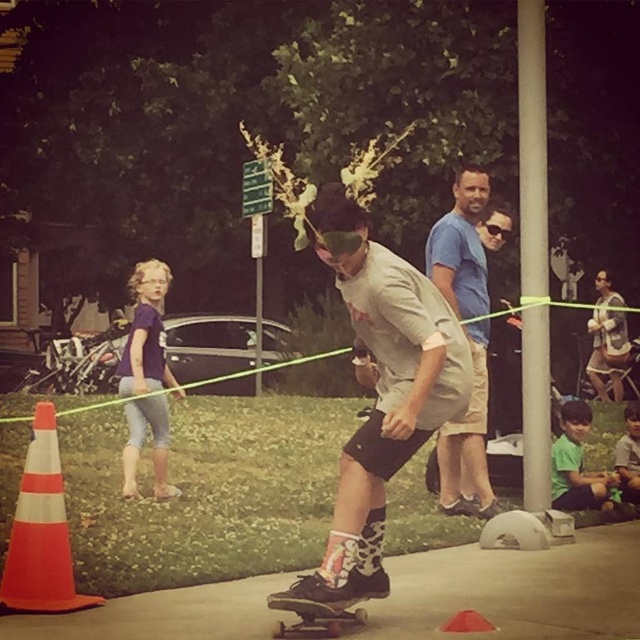
Is point (337, 228) behind point (52, 504)?

That is False.

Identify the location of light gray cotton shirt at center. (381, 388).

Between point (364, 451) and point (40, 557), which one is positioned in front?

Positioned in front is point (364, 451).

Image resolution: width=640 pixels, height=640 pixels. I want to click on light gray cotton shirt at center, so click(x=381, y=388).

Who is more forward, [410,396] or [460,512]?

Point [410,396] is more forward.

Who is positioned more to the left, light gray cotton shirt at center or light blue cotton shirt at center?

Positioned to the left is light gray cotton shirt at center.

The height and width of the screenshot is (640, 640). I want to click on light gray cotton shirt at center, so click(381, 388).

This screenshot has height=640, width=640. Find the location of `light gray cotton shirt at center`. light gray cotton shirt at center is located at coordinates (381, 388).

Which of these two, orange/white striped cone at left or plaid flannel shirt at center, stands shorter?

orange/white striped cone at left is shorter.

Is point (45, 497) closer to camera compared to point (586, 321)?

Yes, point (45, 497) is closer to viewer.

Where is `orange/white striped cone at left`? Image resolution: width=640 pixels, height=640 pixels. orange/white striped cone at left is located at coordinates (42, 531).